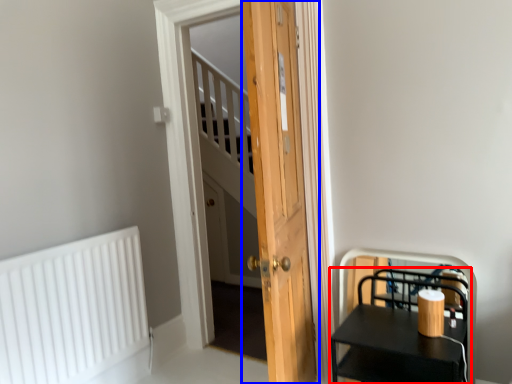
Question: Which point is further to the camera, furniture (highlighted by a red box) or door (highlighted by a blue box)?

Choices:
 (A) furniture
 (B) door

Answer: (A)